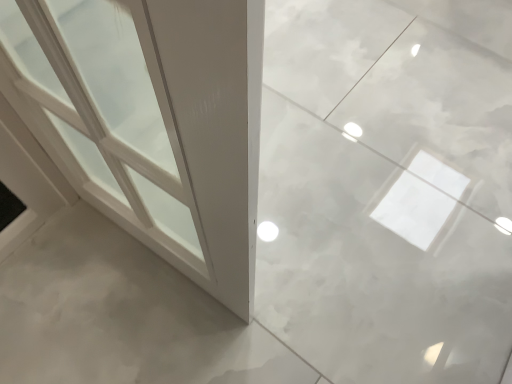
Question: Should I look upward or downward to see white polished concrete at center?

Choices:
 (A) up
 (B) down

Answer: (B)